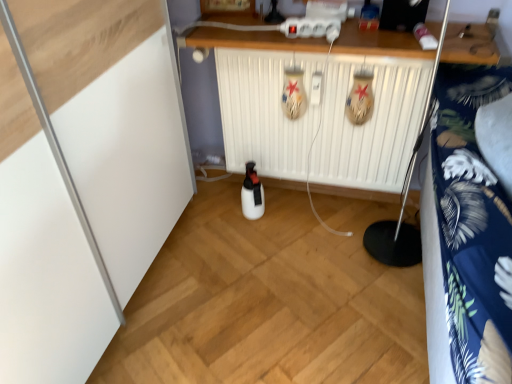
The width and height of the screenshot is (512, 384). Describe the element at coordinates (470, 228) in the screenshot. I see `blue floral fabric at right` at that location.

What do you see at coordinates (247, 36) in the screenshot? This screenshot has width=512, height=384. I see `white wood counter at upper center` at bounding box center [247, 36].

Find the location of `white plastic radiator at center`. white plastic radiator at center is located at coordinates (370, 124).

This screenshot has width=512, height=384. Find the location of `blue floral fabric at right`. blue floral fabric at right is located at coordinates (470, 228).

From a real-world perspective, is white plastic radiator at center beneath white wood counter at upper center?

Yes, from a real-world perspective, white plastic radiator at center is beneath white wood counter at upper center.

Is white plastic radiator at center oriented away from white wood counter at upper center?

No, white plastic radiator at center is not facing the opposite direction of white wood counter at upper center.

Can you confirm if white plastic radiator at center is wider than white wood counter at upper center?

In fact, white plastic radiator at center might be narrower than white wood counter at upper center.

In the image, is white plastic radiator at center on the left side or the right side of white wood counter at upper center?

white plastic radiator at center is to the left of white wood counter at upper center.

Is white wood counter at upper center positioned far away from white plastic radiator at center?

No, white wood counter at upper center is not far from white plastic radiator at center.

From a real-world perspective, is white wood counter at upper center positioned over white plastic radiator at center based on gravity?

Yes, from a real-world perspective, white wood counter at upper center is above white plastic radiator at center.

From the image's perspective, between white wood counter at upper center and white plastic radiator at center, which one is located above?

white wood counter at upper center.

Which is more to the right, white wood counter at upper center or white plastic radiator at center?

white wood counter at upper center is more to the right.

Would you say white plastic radiator at center is a long distance from blue floral fabric at right?

That's not correct — white plastic radiator at center is a little close to blue floral fabric at right.

Which is more to the left, white plastic radiator at center or blue floral fabric at right?

white plastic radiator at center.

Between white plastic radiator at center and blue floral fabric at right, which one has smaller width?

Thinner between the two is white plastic radiator at center.

Can we say white plastic radiator at center lies outside blue floral fabric at right?

Yes, white plastic radiator at center is not within blue floral fabric at right.

Is blue floral fabric at right taller or shorter than white plastic radiator at center?

In the image, blue floral fabric at right appears to be taller than white plastic radiator at center.

Based on their positions, is blue floral fabric at right located to the left or right of white plastic radiator at center?

blue floral fabric at right is to the right of white plastic radiator at center.

Does blue floral fabric at right lie in front of white plastic radiator at center?

Yes, it is in front of white plastic radiator at center.

Is blue floral fabric at right with white plastic radiator at center?

blue floral fabric at right and white plastic radiator at center are not in contact.

Looking at their sizes, would you say white wood counter at upper center is wider or thinner than blue floral fabric at right?

Clearly, white wood counter at upper center has less width compared to blue floral fabric at right.

In the scene shown: Considering the positions of objects white wood counter at upper center and blue floral fabric at right in the image provided, who is in front, white wood counter at upper center or blue floral fabric at right?

Positioned in front is blue floral fabric at right.

From the image's perspective, which one is positioned lower, white wood counter at upper center or blue floral fabric at right?

blue floral fabric at right is shown below in the image.

Does white wood counter at upper center have a lesser height compared to blue floral fabric at right?

Yes.

Would you consider blue floral fabric at right to be distant from white wood counter at upper center?

blue floral fabric at right is actually quite close to white wood counter at upper center.

Who is shorter, blue floral fabric at right or white wood counter at upper center?

white wood counter at upper center.

In terms of width, does blue floral fabric at right look wider or thinner when compared to white wood counter at upper center?

blue floral fabric at right is wider than white wood counter at upper center.

Which of these two, blue floral fabric at right or white wood counter at upper center, is smaller?

With smaller size is white wood counter at upper center.

Find the location of `counter that appears in front of the white plastic radiator at center`. counter that appears in front of the white plastic radiator at center is located at coordinates (247, 36).

Locate an element on the screen. The height and width of the screenshot is (384, 512). radiator located on the left of white wood counter at upper center is located at coordinates (370, 124).

Based on their spatial positions, is blue floral fabric at right or white wood counter at upper center closer to white plastic radiator at center?

white wood counter at upper center is closer to white plastic radiator at center.

Considering their positions, is white plastic radiator at center positioned further to blue floral fabric at right than white wood counter at upper center?

white plastic radiator at center is further to blue floral fabric at right.

Considering their positions, is white plastic radiator at center positioned further to white wood counter at upper center than blue floral fabric at right?

The object further to white wood counter at upper center is blue floral fabric at right.

From the image, which object appears to be farther from white wood counter at upper center, blue floral fabric at right or white plastic radiator at center?

Among the two, blue floral fabric at right is located further to white wood counter at upper center.

Estimate the real-world distances between objects in this image. Which object is closer to white plastic radiator at center, white wood counter at upper center or blue floral fabric at right?

white wood counter at upper center lies closer to white plastic radiator at center than the other object.

Estimate the real-world distances between objects in this image. Which object is closer to blue floral fabric at right, white wood counter at upper center or white plastic radiator at center?

white wood counter at upper center lies closer to blue floral fabric at right than the other object.

This screenshot has width=512, height=384. I want to click on counter positioned between blue floral fabric at right and white plastic radiator at center from near to far, so click(247, 36).